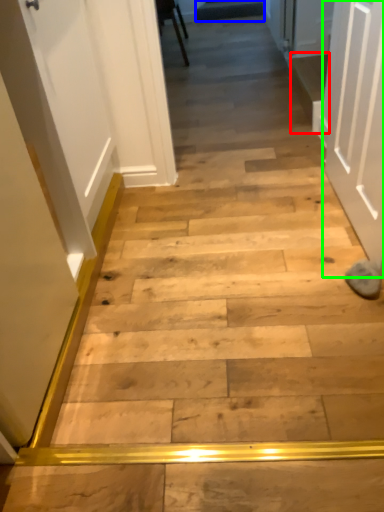
Question: Which object is the closest to the stairwell (highlighted by a red box)? Choose among these: stairwell (highlighted by a blue box) or door (highlighted by a green box).

Choices:
 (A) stairwell
 (B) door

Answer: (B)